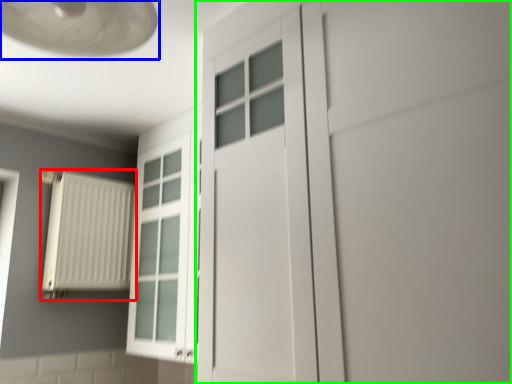
Question: Based on their relative distances, which object is farther from radiator (highlighted by a red box)? Choose from lamp (highlighted by a blue box) and door (highlighted by a green box).

Choices:
 (A) lamp
 (B) door

Answer: (B)